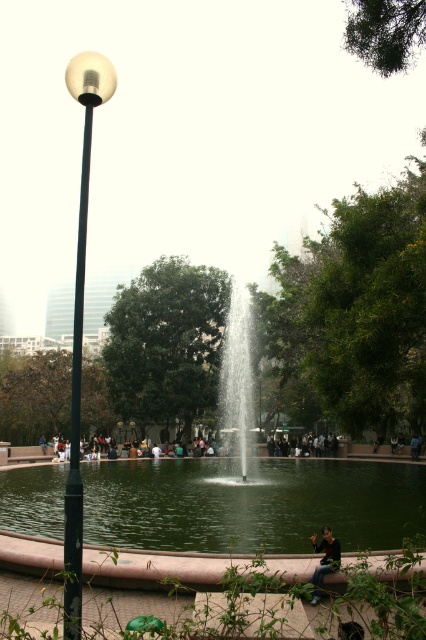
Between green concrete fountain at center and clear water fountain at center, which one appears on the left side from the viewer's perspective?

Positioned to the left is green concrete fountain at center.

Which is behind, point (397, 515) or point (221, 387)?

The point (221, 387) is more distant.

Where is `green concrete fountain at center`? Image resolution: width=426 pixels, height=640 pixels. green concrete fountain at center is located at coordinates pyautogui.click(x=255, y=500).

Is point (374, 465) positioned in front of point (321, 541)?

No, it is not.

Which of these two, green concrete fountain at center or dark green fabric jacket at lower center, stands shorter?

dark green fabric jacket at lower center

Between point (115, 474) and point (325, 536), which one is positioned in front?

Point (325, 536) is in front.

Locate an element on the screen. The width and height of the screenshot is (426, 640). green concrete fountain at center is located at coordinates (255, 500).

Is green liquid water at center to the left of dark blue jeans at center from the viewer's perspective?

Correct, you'll find green liquid water at center to the left of dark blue jeans at center.

Can you confirm if green liquid water at center is bigger than dark blue jeans at center?

Indeed, green liquid water at center has a larger size compared to dark blue jeans at center.

This screenshot has height=640, width=426. What do you see at coordinates (250, 502) in the screenshot?
I see `green liquid water at center` at bounding box center [250, 502].

Locate an element on the screen. This screenshot has height=640, width=426. green liquid water at center is located at coordinates (250, 502).